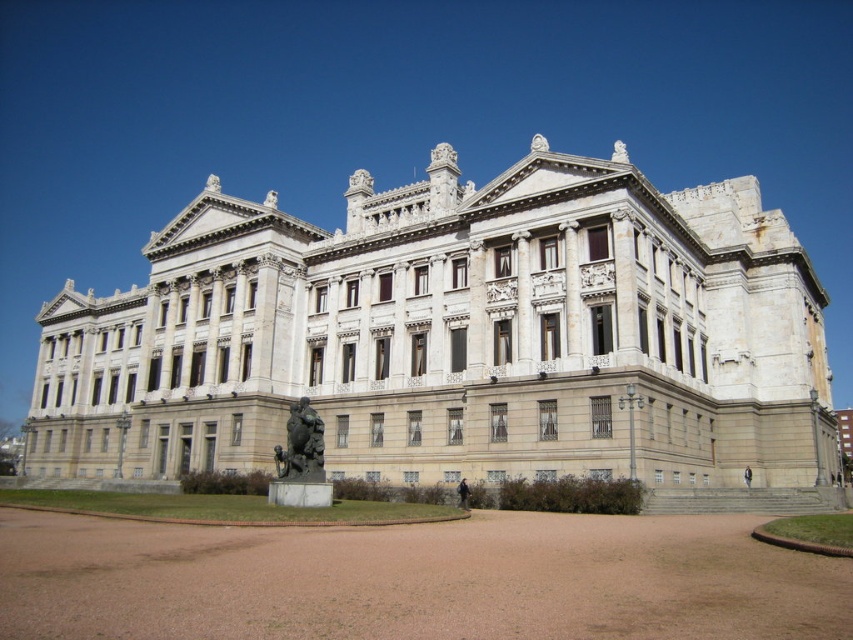
Question: Which of the following is the closest to the observer?

Choices:
 (A) bronze statue at center
 (B) white marble palace at center

Answer: (A)

Question: Is white marble palace at center further to camera compared to bronze statue at center?

Choices:
 (A) yes
 (B) no

Answer: (A)

Question: Does white marble palace at center lie behind bronze statue at center?

Choices:
 (A) yes
 (B) no

Answer: (A)

Question: Is white marble palace at center thinner than bronze statue at center?

Choices:
 (A) yes
 (B) no

Answer: (B)

Question: Which point is farther to the camera?

Choices:
 (A) white marble palace at center
 (B) bronze statue at center

Answer: (A)